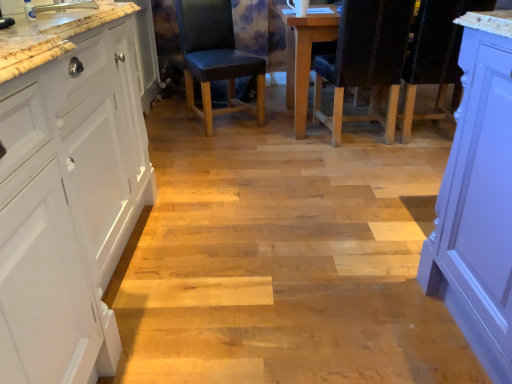
This screenshot has height=384, width=512. I want to click on free spot to the right of white matte cabinet at left, so click(x=262, y=254).